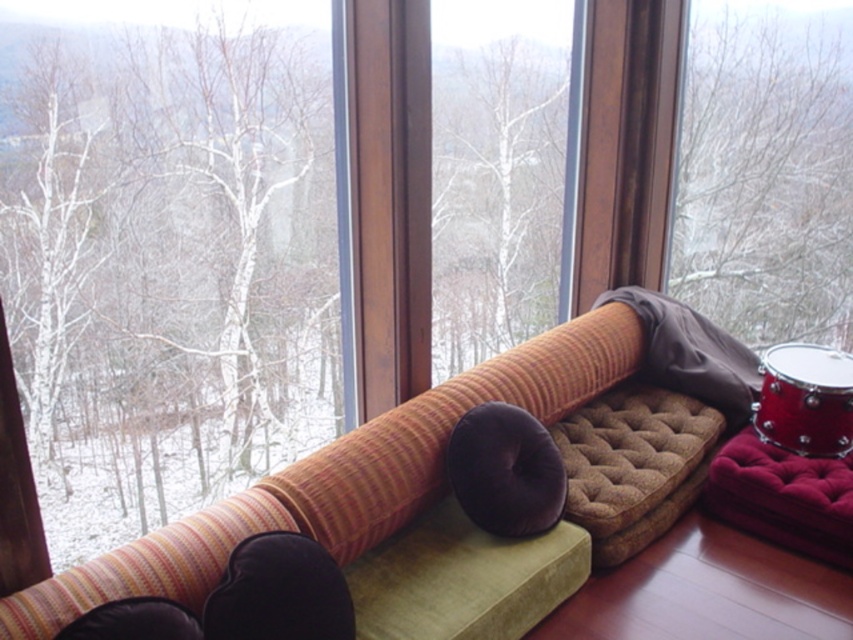
You are standing in the cozy indoor setting and want to place a small decoration between the two points, point (543, 440) and point (787, 444). Which point is closer to you where you should start placing the decoration?

Point (543, 440) is closer to the viewer than point (787, 444), so you should start placing the decoration near point (543, 440).

You are a delivery person who needs to place a small package between the velvet maroon stool at lower right and the shiny red drum at lower right. Can you fit the package if it measures 7 inches in length?

The velvet maroon stool at lower right is 7.33 inches from the shiny red drum at lower right. Since the package is 7 inches long, it can fit between them as the distance is slightly larger than the package length.

You are planning to place a large potted plant in the living room. The potted plant requires a space that can accommodate its size. Given the available objects, which one would be more suitable to place the plant on, the striped fabric couch at center or the velvet maroon stool at lower right?

The striped fabric couch at center is larger in size than the velvet maroon stool at lower right, so the striped fabric couch at center would be more suitable to place the large potted plant on as it has more space.